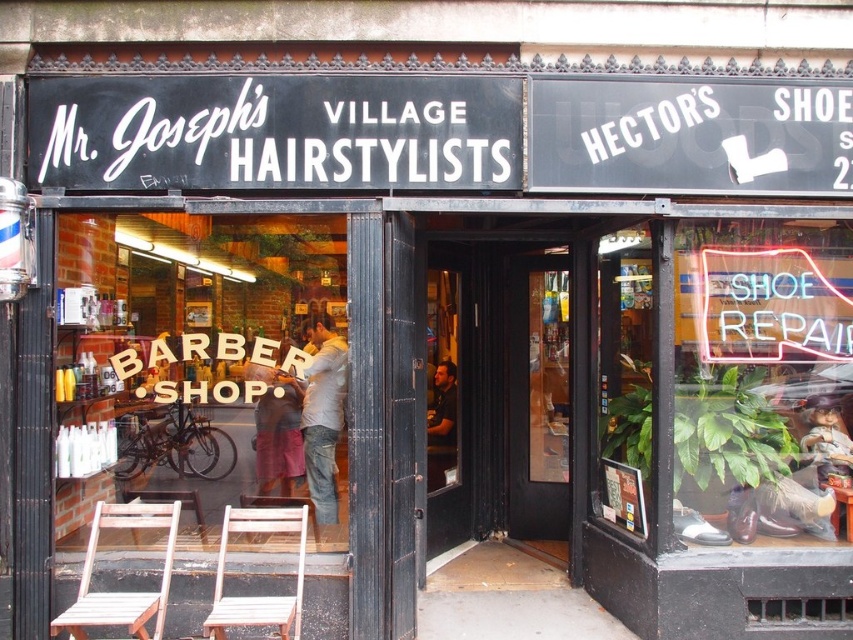
Between point (328, 506) and point (436, 376), which one is positioned behind?

Positioned behind is point (436, 376).

Is point (320, 458) farther from camera compared to point (432, 481)?

No, it is in front of (432, 481).

Is point (302, 403) less distant than point (437, 412)?

Yes, it is in front of point (437, 412).

Image resolution: width=853 pixels, height=640 pixels. What are the coordinates of `light gray shirt at center` in the screenshot? It's located at (323, 416).

Is point (306, 435) behind point (850, 512)?

That is True.

Does light gray shirt at center have a lesser width compared to wooden stool at lower right?

In fact, light gray shirt at center might be wider than wooden stool at lower right.

Does point (317, 477) come farther from viewer compared to point (840, 499)?

Yes, it is behind point (840, 499).

I want to click on light gray shirt at center, so click(x=323, y=416).

Is light brown wooden chair at center smaller than wooden stool at lower left?

No.

Consider the image. Is light brown wooden chair at center to the right of wooden stool at lower left from the viewer's perspective?

Correct, you'll find light brown wooden chair at center to the right of wooden stool at lower left.

Who is more distant from viewer, (248,600) or (128,496)?

The point (128,496) is behind.

Locate an element on the screen. light brown wooden chair at center is located at coordinates point(264,595).